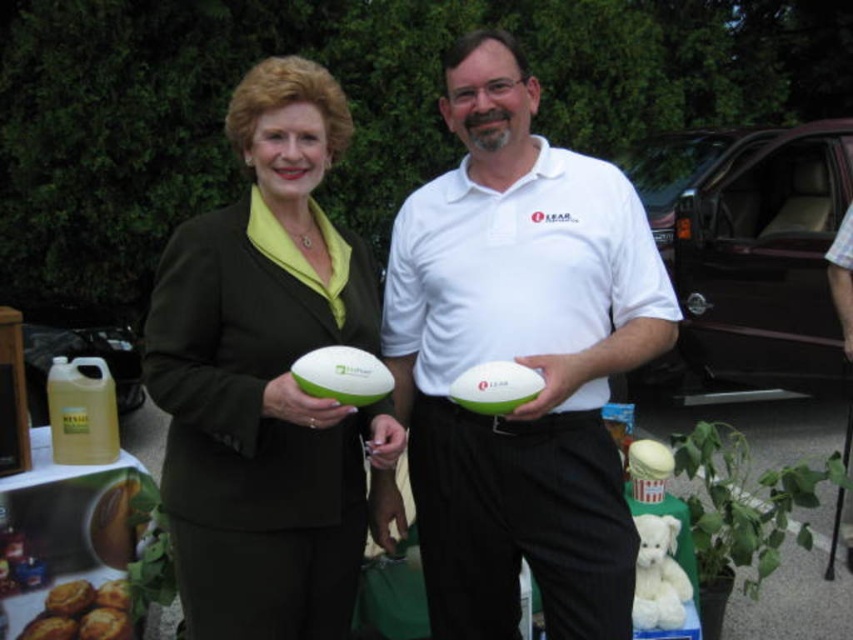
Who is shorter, matte green suit at center or golden brown bread at lower left?

golden brown bread at lower left is shorter.

Between point (177, 433) and point (56, 609), which one is positioned in front?

Point (177, 433)

You are a GUI agent. You are given a task and a screenshot of the screen. Output one action in this format:
    pyautogui.click(x=<x>, y=<y>)
    Task: Click on the matte green suit at center
    This screenshot has height=640, width=853.
    Given the screenshot: What is the action you would take?
    pyautogui.click(x=265, y=378)

Between point (405, 232) and point (126, 616), which one is positioned in front?

Point (405, 232)

Can you confirm if white matte polo shirt at center is positioned to the right of golden brown muffin at lower left?

Indeed, white matte polo shirt at center is positioned on the right side of golden brown muffin at lower left.

Does point (498, 536) come behind point (117, 637)?

No, it is in front of (117, 637).

I want to click on white matte polo shirt at center, so click(519, 358).

Who is lower down, white matte polo shirt at center or matte green suit at center?

white matte polo shirt at center is below.

Between point (480, 497) and point (260, 538), which one is positioned in front?

Point (260, 538) is in front.

The image size is (853, 640). Find the location of `white matte polo shirt at center`. white matte polo shirt at center is located at coordinates (519, 358).